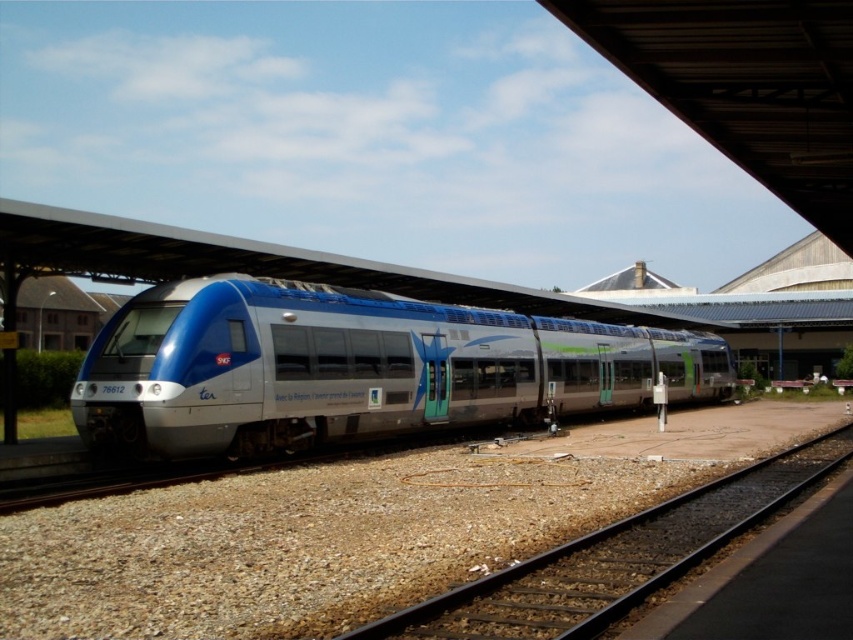
Is matte metallic train at center taller than black metal train track at lower center?

Correct, matte metallic train at center is much taller as black metal train track at lower center.

Is matte metallic train at center above black metal train track at lower center?

Yes, matte metallic train at center is above black metal train track at lower center.

Identify the location of matte metallic train at center. Image resolution: width=853 pixels, height=640 pixels. (352, 368).

Locate an element on the screen. The image size is (853, 640). matte metallic train at center is located at coordinates (352, 368).